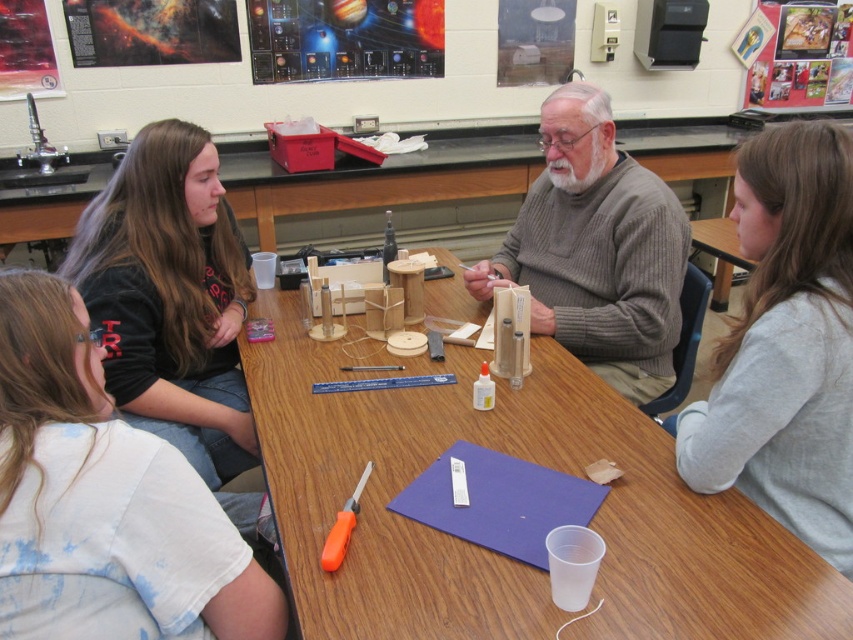
You are a student in the classroom and you need to hand in your assignment to the teacher. You see the gray cotton shirt at upper right and the orange plastic screwdriver at lower center. Which object is closer to the ceiling?

The gray cotton shirt at upper right is located above the orange plastic screwdriver at lower center, so it is closer to the ceiling.

You are a student at the table and need to hand the orange plastic screwdriver at lower center to the teacher who is standing behind the gray ribbed sweater at center. Can you reach the screwdriver without moving from your current position?

The gray ribbed sweater at center is 38.16 inches away from the orange plastic screwdriver at lower center. Since 38.16 inches is approximately 3.18 feet, which is a considerable distance, you may need to move closer to reach the screwdriver without straining.

You are a student sitting at the table and need to reach for the orange plastic screwdriver at lower center. Is the gray ribbed sweater at center blocking your access to it?

The gray ribbed sweater at center is taller than the orange plastic screwdriver at lower center. Since the sweater is taller, it might block the view or access to the screwdriver depending on their positions.